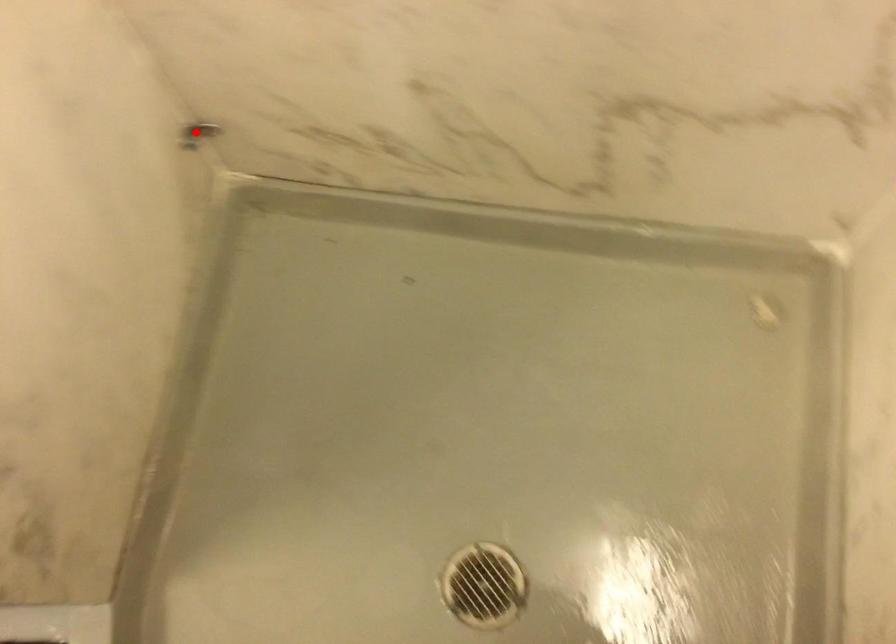
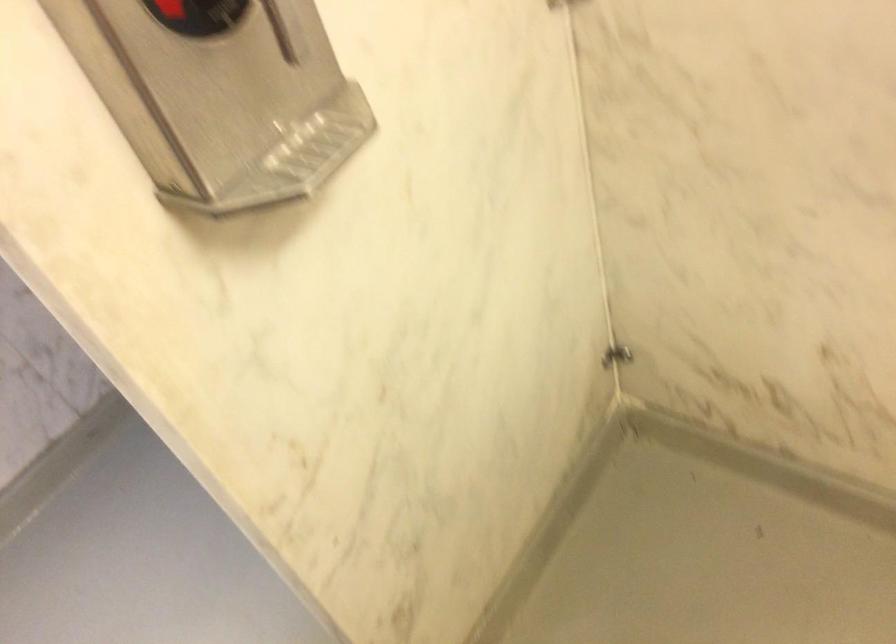
Question: I am providing you with two images of the same scene from different viewpoints. In image1, a red point is highlighted. Considering the same 3D point in image2, which of the following is correct?

Choices:
 (A) It is closer
 (B) It is farther

Answer: (B)